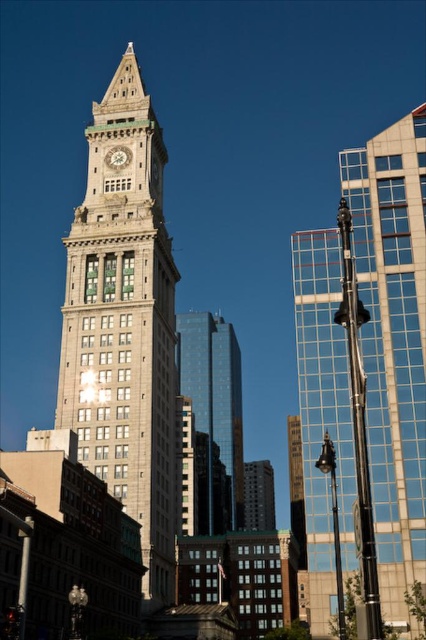
Measure the distance from polished glass tower at center to matte gray clock at center.

116.70 feet

Where is `polished glass tower at center`? polished glass tower at center is located at coordinates (393, 342).

Where is `polished glass tower at center`? The height and width of the screenshot is (640, 426). polished glass tower at center is located at coordinates (393, 342).

Does light gray stone clock tower at center appear on the right side of shiny glass skyscraper at center?

No, light gray stone clock tower at center is not to the right of shiny glass skyscraper at center.

Who is more forward, (94, 340) or (230, 524)?

Positioned in front is point (94, 340).

This screenshot has width=426, height=640. In order to click on light gray stone clock tower at center in this screenshot , I will do pyautogui.click(x=124, y=324).

Is polished glass tower at center smaller than light gray stone clock tower at center?

Yes, polished glass tower at center is smaller than light gray stone clock tower at center.

Can you confirm if polished glass tower at center is positioned below light gray stone clock tower at center?

Yes, polished glass tower at center is below light gray stone clock tower at center.

Describe the element at coordinates (393, 342) in the screenshot. The image size is (426, 640). I see `polished glass tower at center` at that location.

Where is `polished glass tower at center`? The image size is (426, 640). polished glass tower at center is located at coordinates (393, 342).